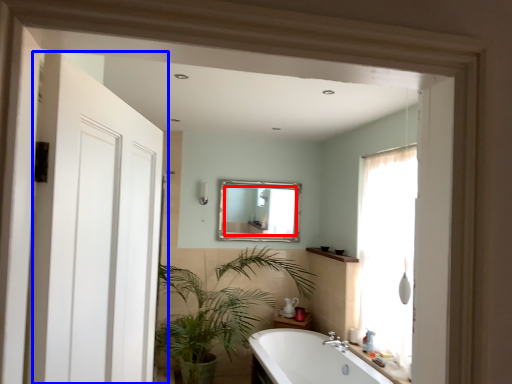
Question: Which object appears closest to the camera in this image, mirror (highlighted by a red box) or door (highlighted by a blue box)?

Choices:
 (A) mirror
 (B) door

Answer: (B)